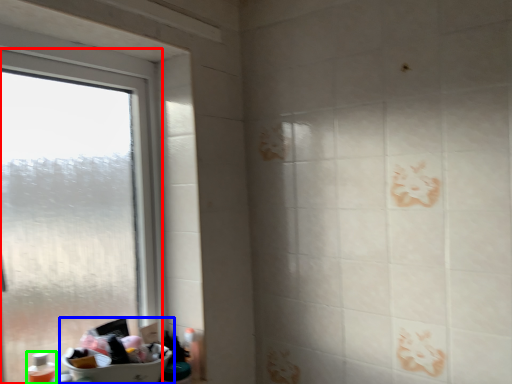
Question: Considering the real-world distances, which object is farthest from window (highlighted by a red box)? sink (highlighted by a blue box) or toiletry (highlighted by a green box)?

Choices:
 (A) sink
 (B) toiletry

Answer: (B)